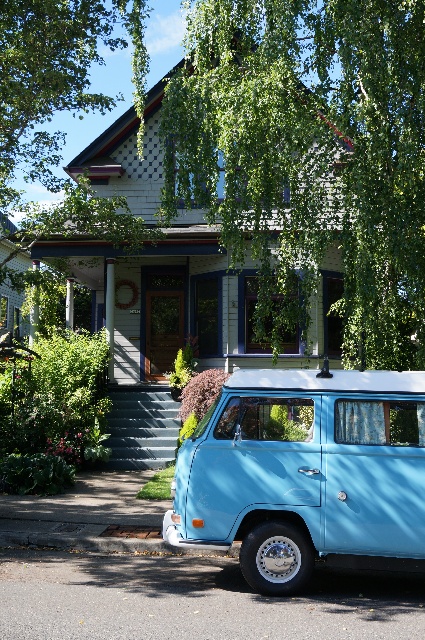
Question: Which of the following is the closest to the observer?

Choices:
 (A) green leafy tree at upper center
 (B) light blue matte van at lower center

Answer: (B)

Question: Is green leafy tree at upper center to the right of smooth concrete steps at center from the viewer's perspective?

Choices:
 (A) yes
 (B) no

Answer: (A)

Question: Considering the real-world distances, which object is closest to the green leafy tree at upper center?

Choices:
 (A) smooth concrete steps at center
 (B) light blue matte van at lower center

Answer: (B)

Question: Is light blue matte van at lower center to the right of smooth concrete steps at center from the viewer's perspective?

Choices:
 (A) no
 (B) yes

Answer: (B)

Question: Does green leafy tree at upper center have a larger size compared to light blue matte van at lower center?

Choices:
 (A) no
 (B) yes

Answer: (B)

Question: Which object is farther from the camera taking this photo?

Choices:
 (A) smooth concrete steps at center
 (B) light blue matte van at lower center
 (C) green leafy tree at upper center

Answer: (A)